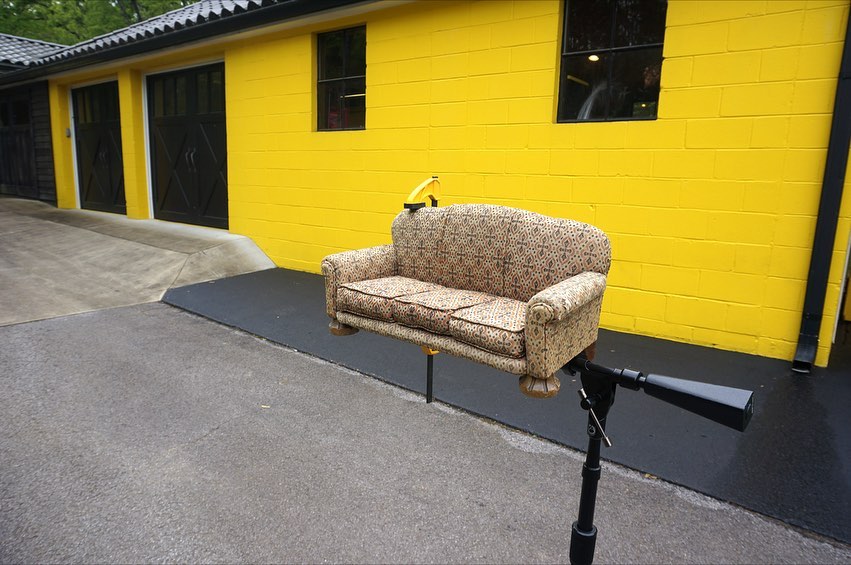
I want to click on windows on doors, so click(x=178, y=108), click(x=203, y=89), click(x=110, y=108), click(x=84, y=108).